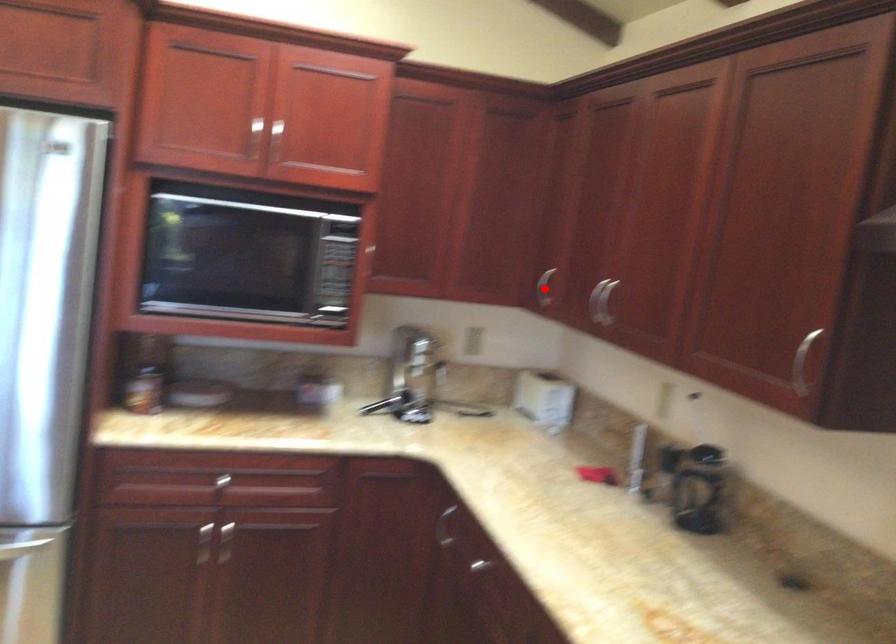
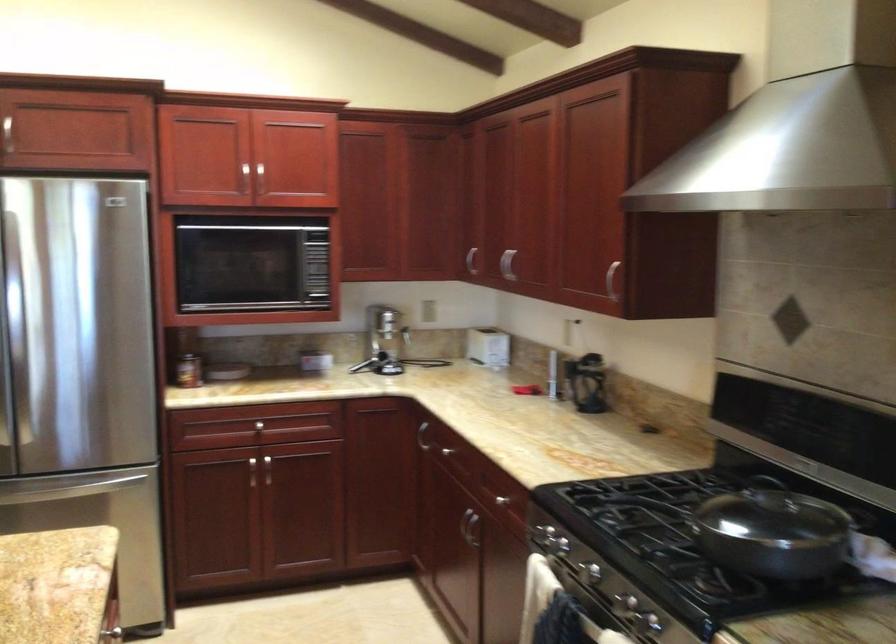
Question: I am providing you with two images of the same scene from different viewpoints. A red point is marked on the first image. Can you still see the location of the red point in image 2?

Choices:
 (A) Yes
 (B) No

Answer: (A)